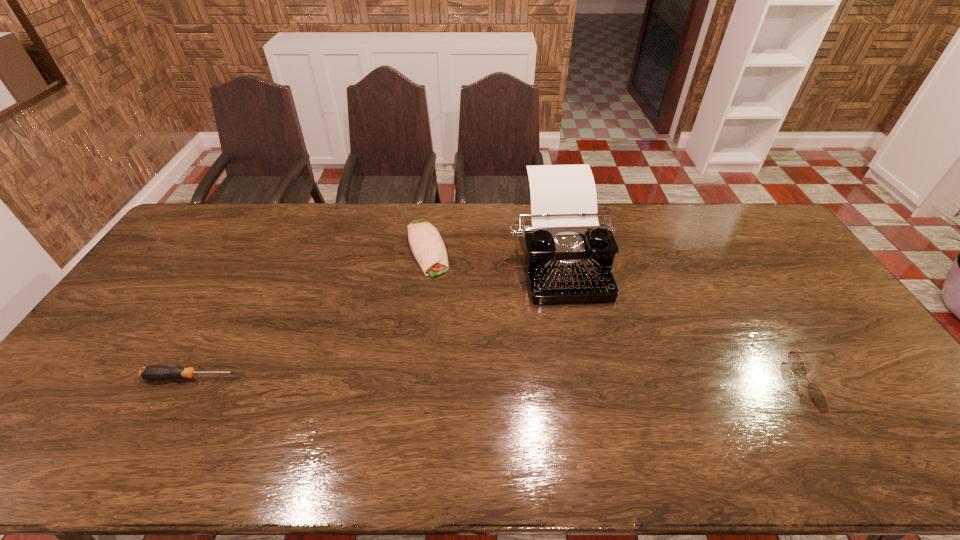
Locate an element on the screen. Image resolution: width=960 pixels, height=540 pixels. free point between the sunglasses and the third object from right to left is located at coordinates (627, 318).

Where is `vacant space that's between the rightmost object and the typewriter`? The image size is (960, 540). vacant space that's between the rightmost object and the typewriter is located at coordinates (693, 321).

Image resolution: width=960 pixels, height=540 pixels. What are the coordinates of `free space between the screwdriver and the burrito` in the screenshot? It's located at (310, 313).

Identify the location of free space between the tallest object and the sunglasses. (693, 321).

What are the coordinates of `unoccupied position between the screwdriver and the sunglasses` in the screenshot? It's located at (510, 382).

Locate an element on the screen. This screenshot has width=960, height=540. free point between the second object from right to left and the sunglasses is located at coordinates (693, 321).

Locate an element on the screen. Image resolution: width=960 pixels, height=540 pixels. empty location between the screwdriver and the tallest object is located at coordinates (375, 317).

At what (x,y) coordinates should I click in order to perform the action: click on the closest object relative to the leftmost object. Please return your answer as a coordinate pair (x, y). The width and height of the screenshot is (960, 540). Looking at the image, I should click on tap(428, 248).

You are a GUI agent. You are given a task and a screenshot of the screen. Output one action in this format:
    pyautogui.click(x=<x>, y=<y>)
    Task: Click on the object that can be found as the second closest to the sunglasses
    
    Given the screenshot: What is the action you would take?
    pyautogui.click(x=428, y=248)

At what (x,y) coordinates should I click in order to perform the action: click on free region that satisfies the following two spatial constraints: 1. on the front side of the tallest object; 2. on the face of the rightmost object. Please return your answer as a coordinate pair (x, y). Looking at the image, I should click on (584, 387).